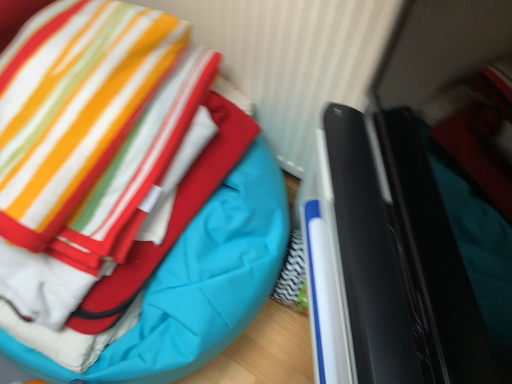
Question: Is teal quilted bean bag at center in contact with black glossy laptop at right?

Choices:
 (A) yes
 (B) no

Answer: (B)

Question: Is teal quilted bean bag at center positioned before black glossy laptop at right?

Choices:
 (A) no
 (B) yes

Answer: (A)

Question: From the image's perspective, is teal quilted bean bag at center on black glossy laptop at right?

Choices:
 (A) yes
 (B) no

Answer: (A)

Question: From a real-world perspective, is teal quilted bean bag at center beneath black glossy laptop at right?

Choices:
 (A) no
 (B) yes

Answer: (B)

Question: Are teal quilted bean bag at center and black glossy laptop at right far apart?

Choices:
 (A) yes
 (B) no

Answer: (B)

Question: Considering the relative sizes of teal quilted bean bag at center and black glossy laptop at right in the image provided, is teal quilted bean bag at center taller than black glossy laptop at right?

Choices:
 (A) yes
 (B) no

Answer: (A)

Question: Is black glossy laptop at right thinner than teal quilted bean bag at center?

Choices:
 (A) no
 (B) yes

Answer: (B)

Question: Can you confirm if black glossy laptop at right is bigger than teal quilted bean bag at center?

Choices:
 (A) no
 (B) yes

Answer: (A)

Question: Does black glossy laptop at right appear on the right side of teal quilted bean bag at center?

Choices:
 (A) yes
 (B) no

Answer: (A)

Question: Does black glossy laptop at right come in front of teal quilted bean bag at center?

Choices:
 (A) yes
 (B) no

Answer: (A)

Question: Considering the relative sizes of black glossy laptop at right and teal quilted bean bag at center in the image provided, is black glossy laptop at right wider than teal quilted bean bag at center?

Choices:
 (A) yes
 (B) no

Answer: (B)

Question: Would you consider black glossy laptop at right to be distant from teal quilted bean bag at center?

Choices:
 (A) yes
 (B) no

Answer: (B)

Question: Considering their positions, is black glossy laptop at right located in front of or behind teal quilted bean bag at center?

Choices:
 (A) behind
 (B) front

Answer: (B)